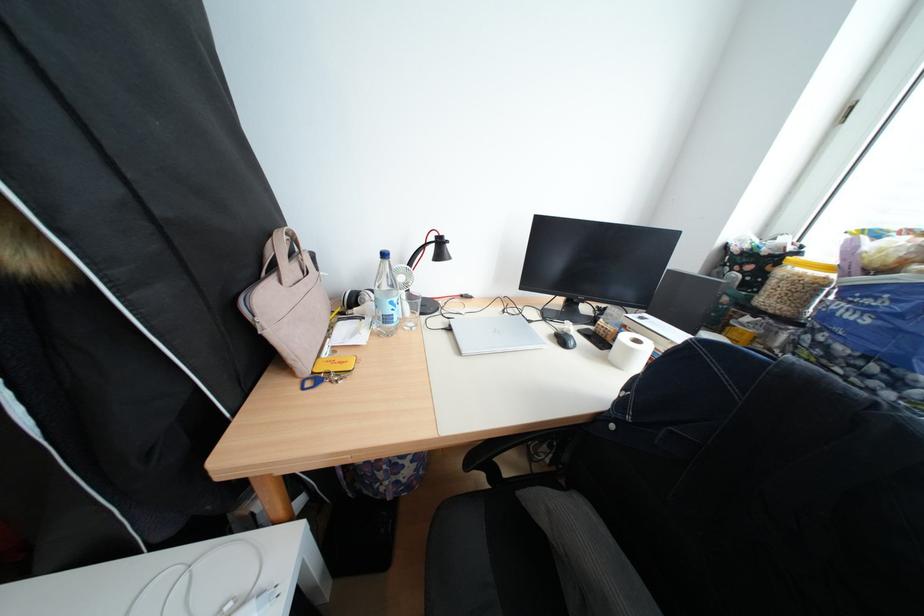
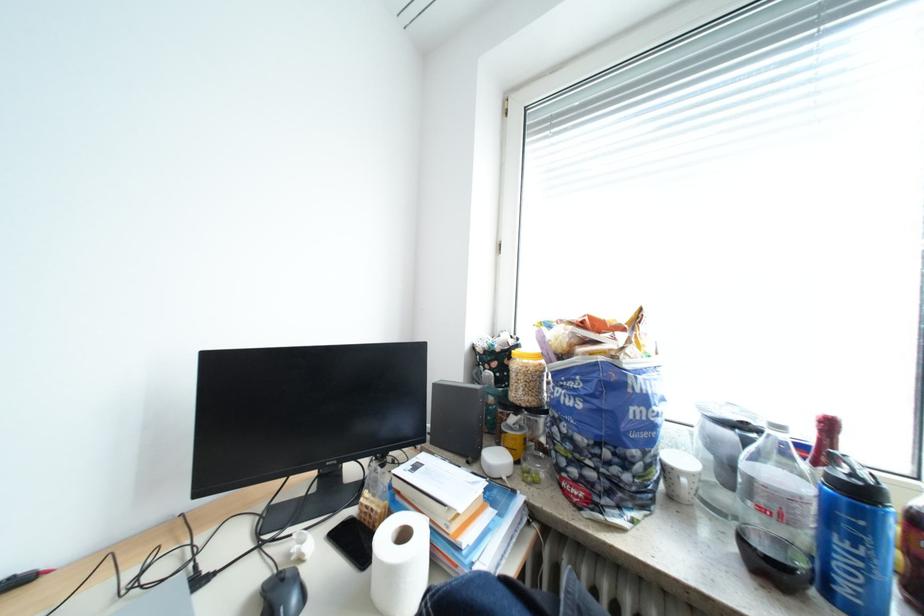
Locate, in the second image, the point that corresponds to [654,318] in the first image.

(428, 468)